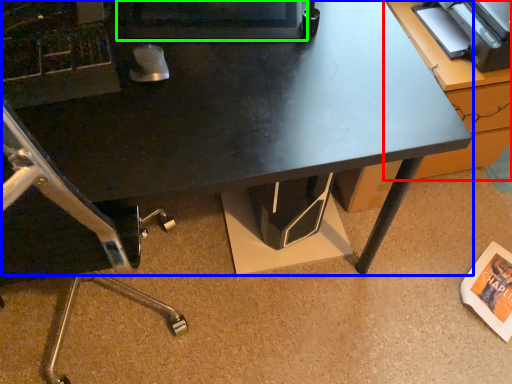
Question: Which is nearer to the table (highlighted by a red box)? desk (highlighted by a blue box) or computer monitor (highlighted by a green box).

Choices:
 (A) desk
 (B) computer monitor

Answer: (A)